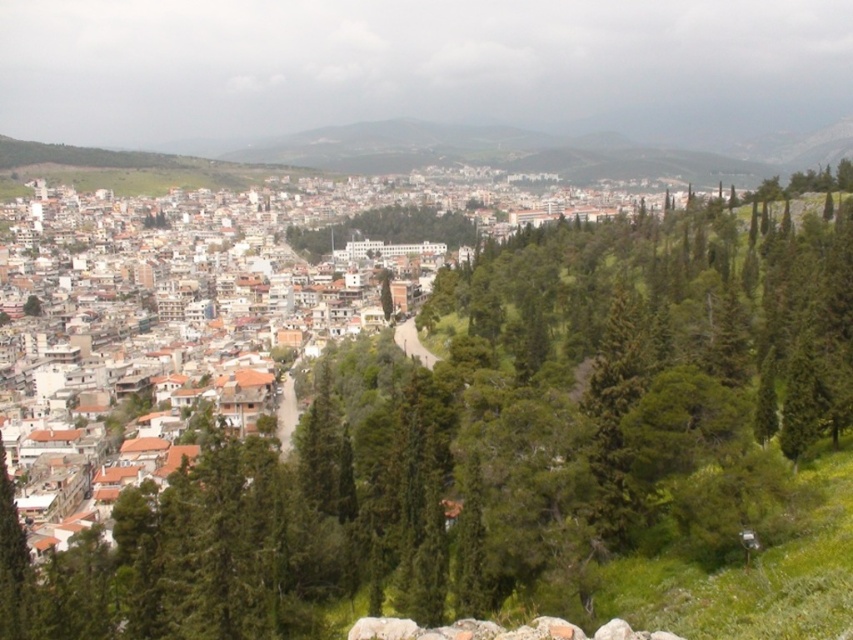
You are standing on the winding road in the foreground and looking towards the town. Which of the two green leafy trees do you see first? The green leafy tree at center or the green leafy trees at center?

The green leafy tree at center is in front of the green leafy trees at center, so you will see the green leafy tree at center first.

You are a hiker standing on the winding road in the foreground of the image. You see the green leafy tree at center and the green leafy trees at center. Which one is taller?

The green leafy tree at center is much taller than the green leafy trees at center.

You are a hiker standing on the mountain path and looking down at the image. You see a green leafy tree at center and green leafy trees at center. Which one is closer to you?

The green leafy tree at center is closer to you because it is positioned below the green leafy trees at center, indicating it is in a lower elevation area.